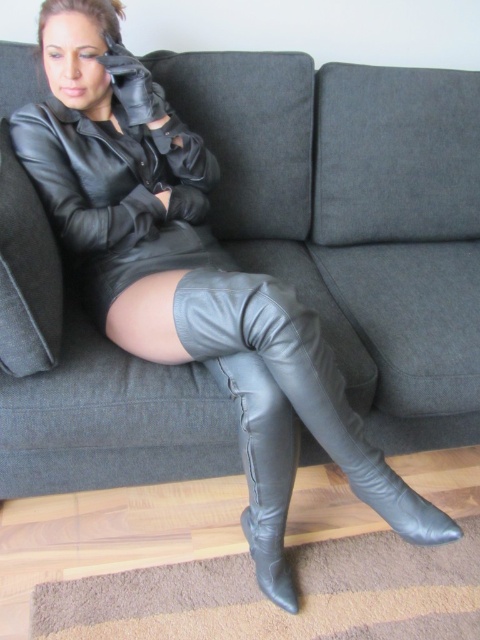
Between gray fabric couch at center and black leather boot at center, which one has less height?

black leather boot at center is shorter.

The width and height of the screenshot is (480, 640). Describe the element at coordinates (356, 218) in the screenshot. I see `gray fabric couch at center` at that location.

You are a GUI agent. You are given a task and a screenshot of the screen. Output one action in this format:
    pyautogui.click(x=<x>, y=<y>)
    Task: Click on the gray fabric couch at center
    This screenshot has height=640, width=480.
    Given the screenshot: What is the action you would take?
    pos(356,218)

Can you confirm if black leather thigh-high boots at lower center is shorter than black leather boot at center?

Yes, black leather thigh-high boots at lower center is shorter than black leather boot at center.

The image size is (480, 640). I want to click on black leather thigh-high boots at lower center, so click(300, 381).

Based on the photo, between black leather dress at center and black leather thigh-high boots at lower center, which one is positioned lower?

Positioned lower is black leather thigh-high boots at lower center.

You are a GUI agent. You are given a task and a screenshot of the screen. Output one action in this format:
    pyautogui.click(x=<x>, y=<y>)
    Task: Click on the black leather dress at center
    
    Given the screenshot: What is the action you would take?
    pyautogui.click(x=120, y=195)

Locate an element on the screen. black leather dress at center is located at coordinates point(120,195).